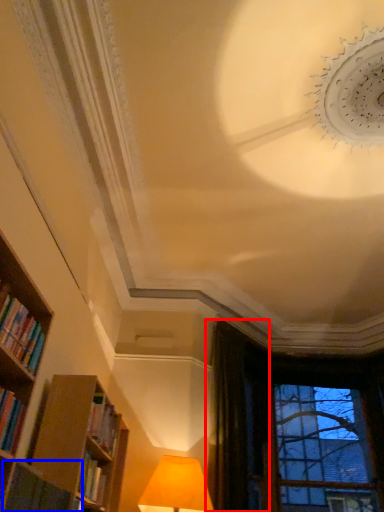
Question: Which point is closer to the camera, curtain (highlighted by a red box) or book (highlighted by a blue box)?

Choices:
 (A) curtain
 (B) book

Answer: (B)